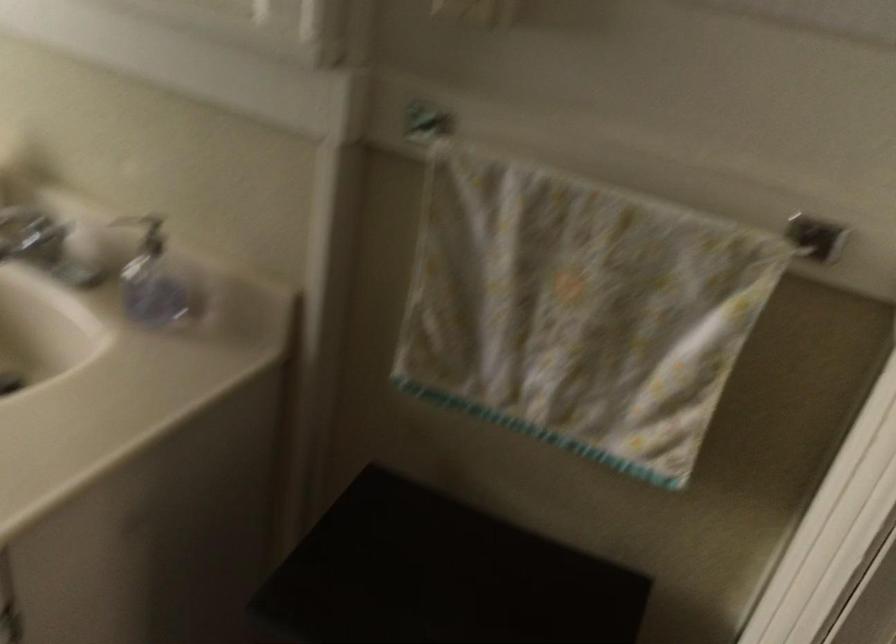
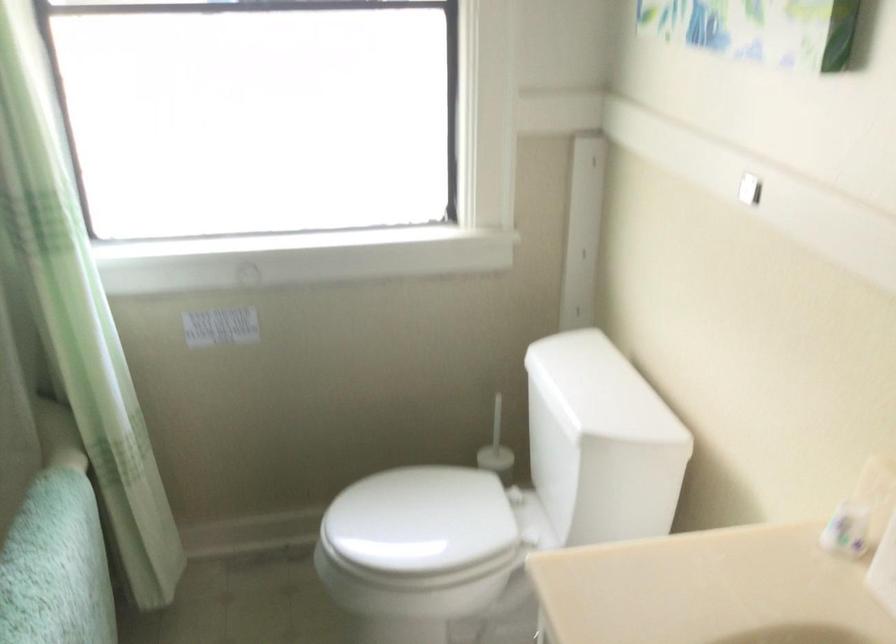
Question: The camera is either moving clockwise (left) or counter-clockwise (right) around the object. The first image is from the beginning of the video and the second image is from the end. Is the camera moving left or right when shooting the video?

Choices:
 (A) Left
 (B) Right

Answer: (B)